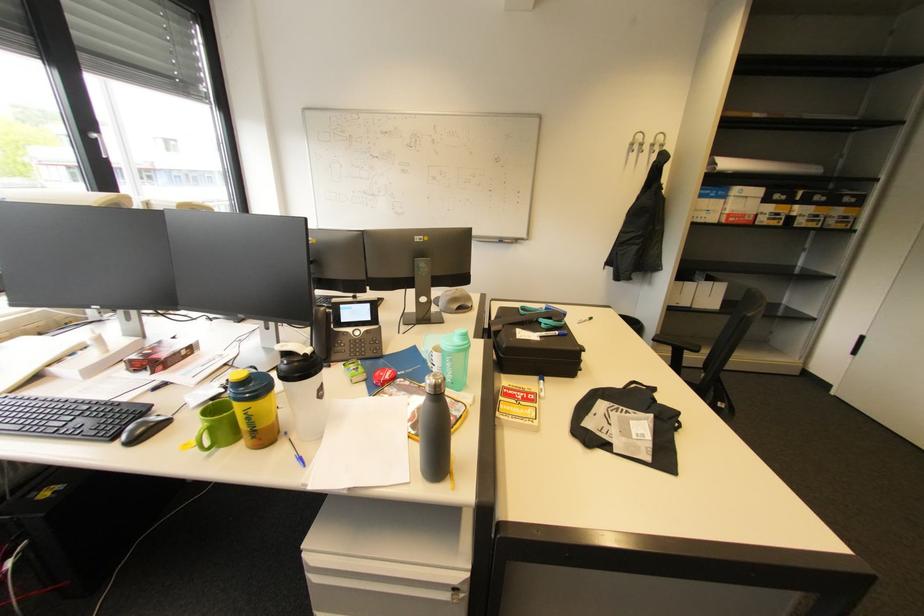
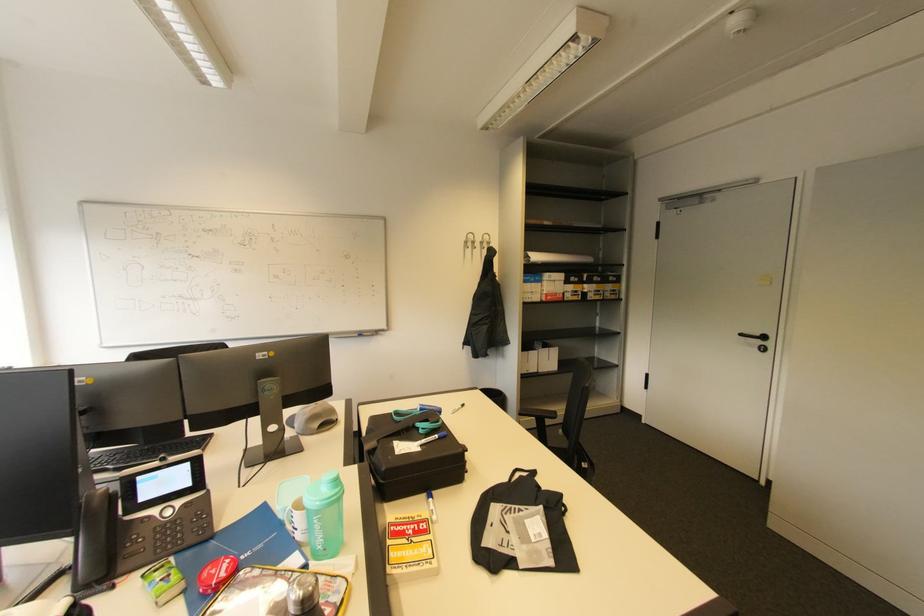
Find the pixel in the second image that matches [541,379] in the first image.

(429, 496)